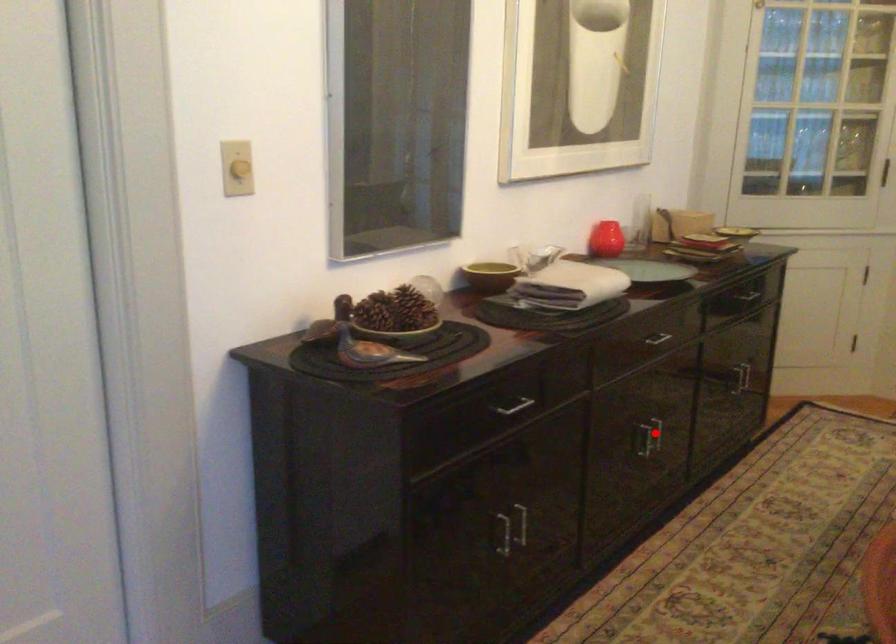
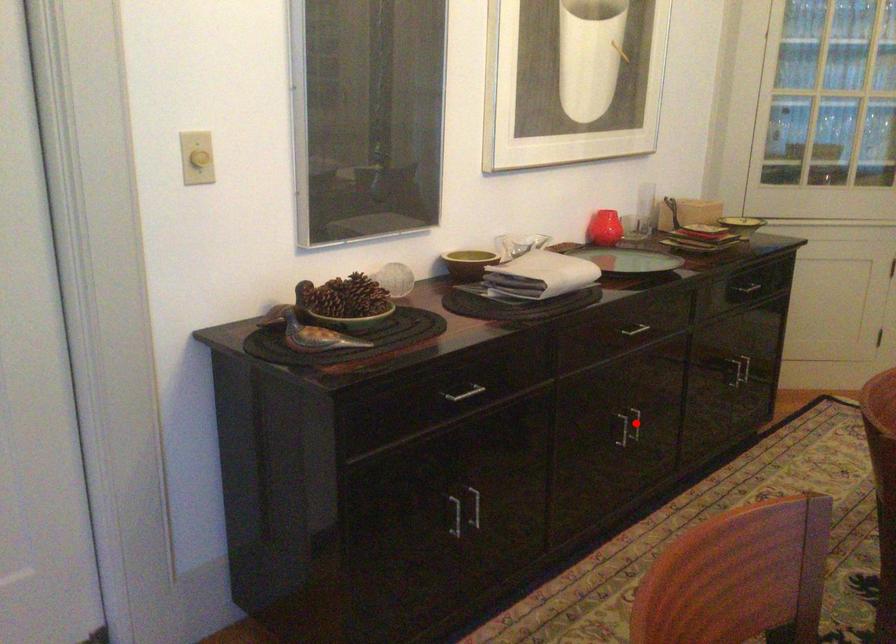
I am providing you with two images of the same scene from different viewpoints. A red point is marked on the first image and another point is marked on the second image. Does the point marked in image1 correspond to the same location as the one in image2?

Yes